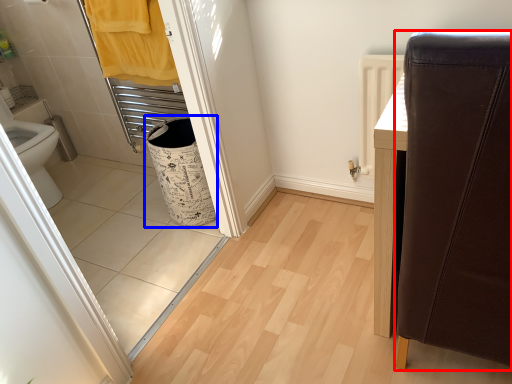
Question: Among these objects, which one is nearest to the camera, furniture (highlighted by a red box) or laundry basket (highlighted by a blue box)?

Choices:
 (A) furniture
 (B) laundry basket

Answer: (A)